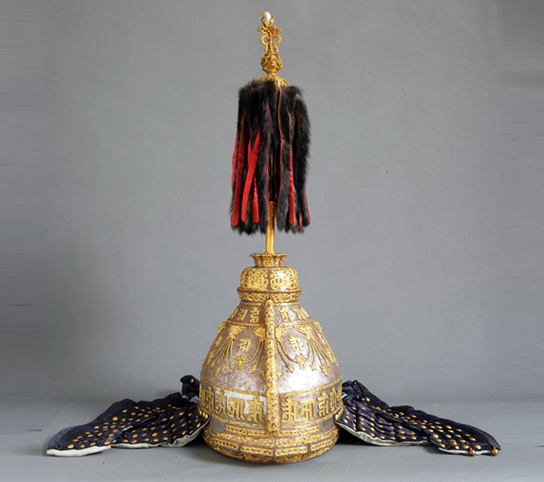
I want to click on wall, so click(175, 330).